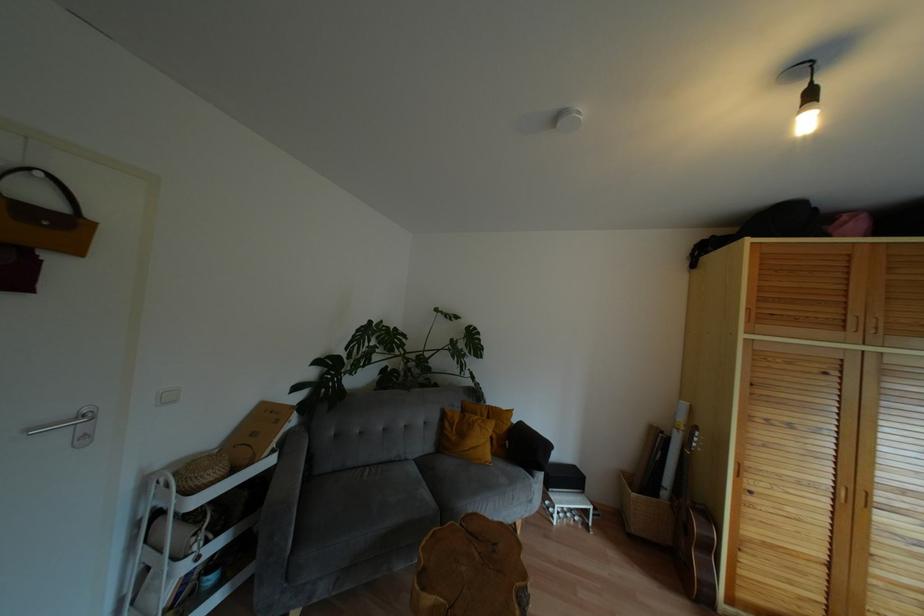
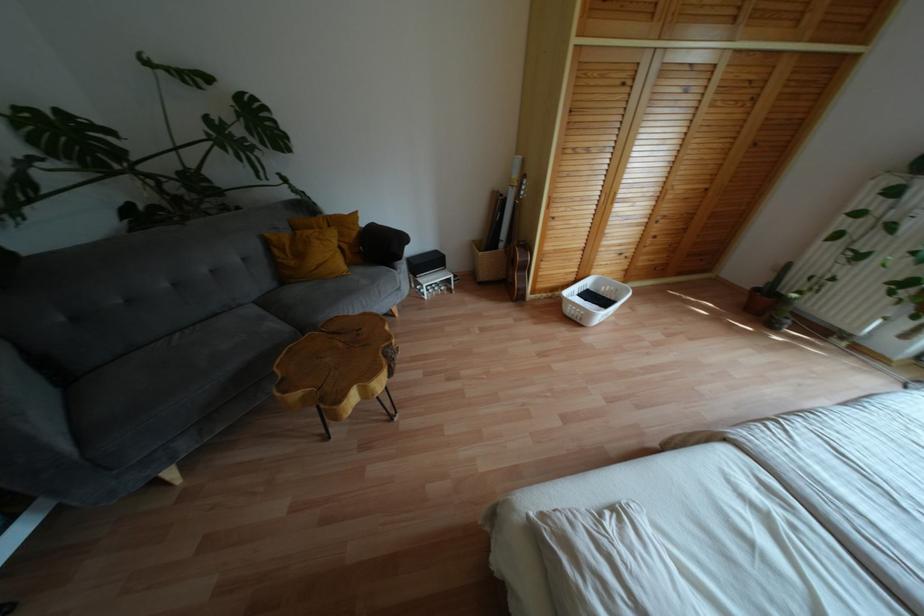
Where in the second image is the point corresponding to (x=475, y=328) from the first image?

(253, 98)